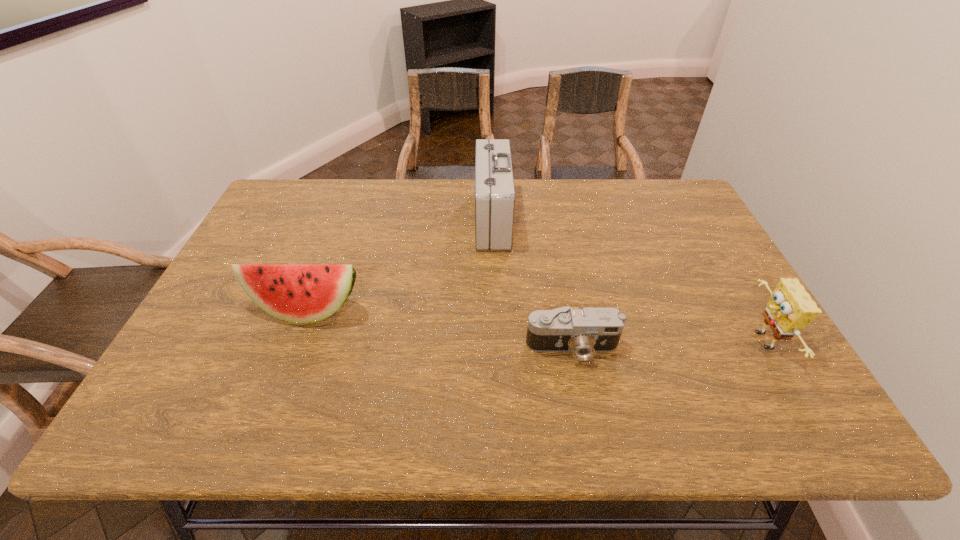
You are a GUI agent. You are given a task and a screenshot of the screen. Output one action in this format:
    pyautogui.click(x=<x>, y=<y>)
    Task: Click on the free space located on the face of the sponge
    
    Given the screenshot: What is the action you would take?
    pyautogui.click(x=704, y=341)

You are a GUI agent. You are given a task and a screenshot of the screen. Output one action in this format:
    pyautogui.click(x=<x>, y=<y>)
    Task: Click on the free space located on the face of the sponge
    
    Given the screenshot: What is the action you would take?
    pyautogui.click(x=725, y=341)

Image resolution: width=960 pixels, height=540 pixels. Find the location of `free location located on the face of the sponge`. free location located on the face of the sponge is located at coordinates (652, 341).

The image size is (960, 540). Find the location of `free space located on the lens of the shortest object`. free space located on the lens of the shortest object is located at coordinates (584, 409).

Locate an element on the screen. This screenshot has width=960, height=540. object located at the far edge is located at coordinates (494, 184).

Where is `object at the left edge`? object at the left edge is located at coordinates (298, 293).

Where is `object at the right edge`? object at the right edge is located at coordinates (790, 308).

Locate an element on the screen. blank area at the far edge is located at coordinates (597, 186).

Where is `free space at the near edge`? free space at the near edge is located at coordinates (427, 407).

Image resolution: width=960 pixels, height=540 pixels. I want to click on vacant space at the right edge of the desktop, so click(745, 292).